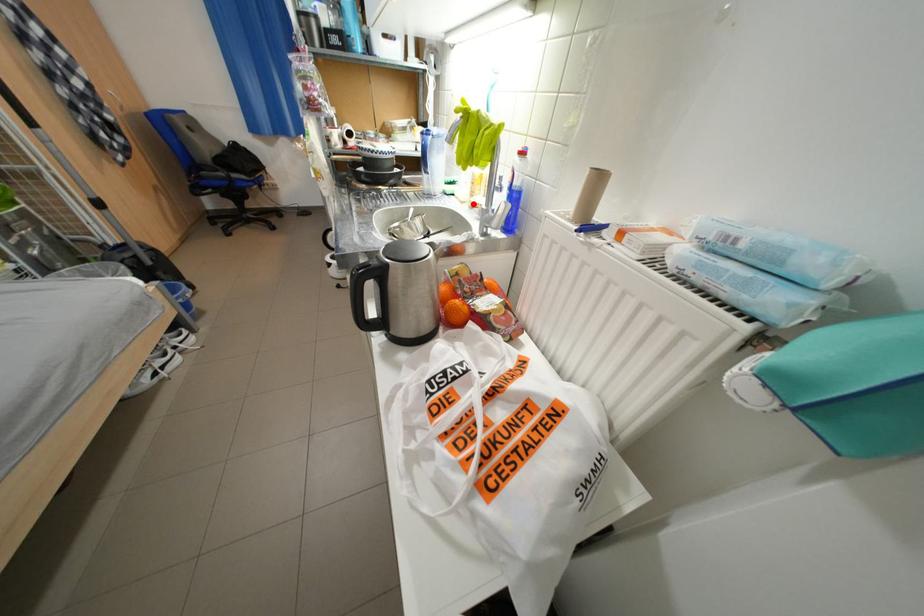
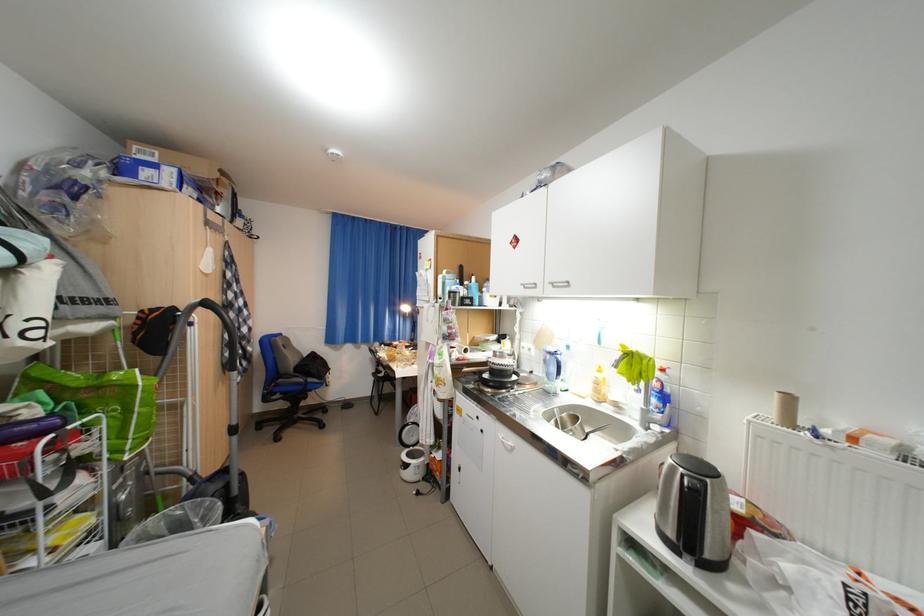
Locate, in the second image, the point that corresponds to the highlighted location in the first image.

(594, 399)